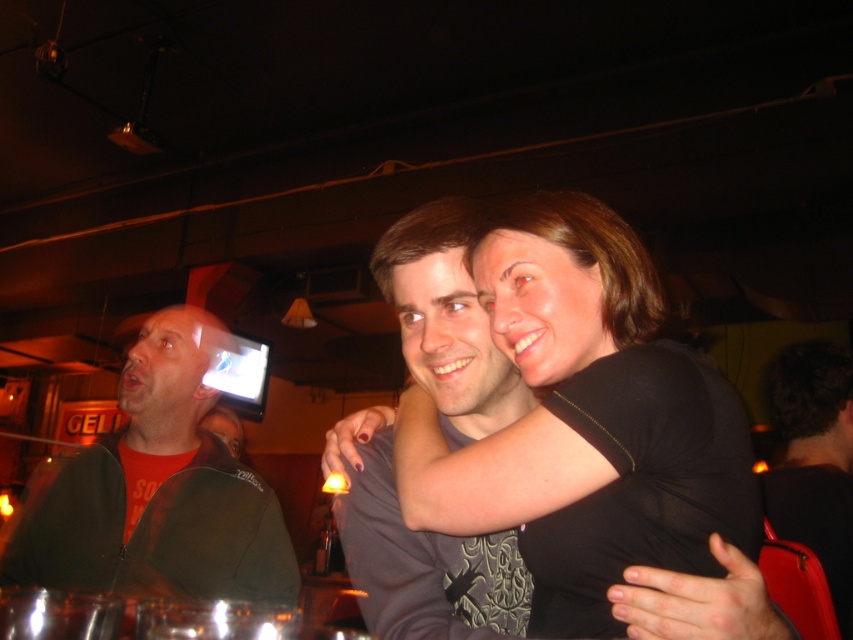
Question: Observing the image, what is the correct spatial positioning of black matte shirt at center in reference to dark brown hair at upper right?

Choices:
 (A) left
 (B) right

Answer: (A)

Question: Is orange matte shirt at left smaller than dark brown hair at upper right?

Choices:
 (A) yes
 (B) no

Answer: (A)

Question: Which of the following is the closest to the observer?

Choices:
 (A) (796, 465)
 (B) (602, 609)

Answer: (B)

Question: Is black matte shirt at center to the right of dark brown hair at upper right from the viewer's perspective?

Choices:
 (A) no
 (B) yes

Answer: (A)

Question: Which is farther from the black matte shirt at center?

Choices:
 (A) dark brown hair at upper right
 (B) orange matte shirt at left

Answer: (A)

Question: Based on their relative distances, which object is nearer to the dark brown hair at upper right?

Choices:
 (A) orange matte shirt at left
 (B) black matte shirt at center

Answer: (B)